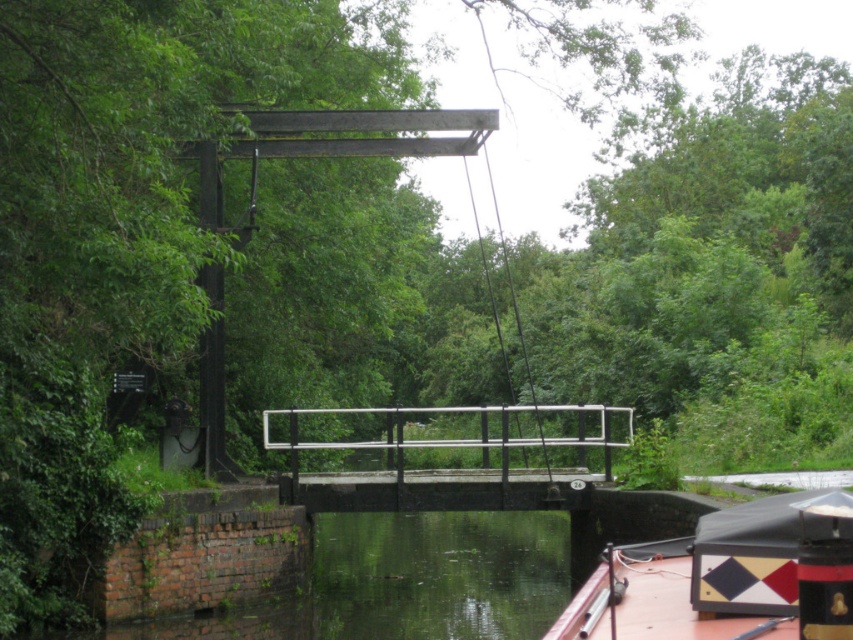
Which is in front, point (776, 524) or point (485, 429)?

Point (776, 524) is more forward.

Is red plastic boat at lower right closer to the viewer compared to white metal rail at center?

Yes, red plastic boat at lower right is in front of white metal rail at center.

Image resolution: width=853 pixels, height=640 pixels. Identify the location of red plastic boat at lower right. (700, 579).

Who is taller, green reflective water at lower center or red plastic boat at lower right?

Standing taller between the two is green reflective water at lower center.

Does green reflective water at lower center have a lesser width compared to red plastic boat at lower right?

No, green reflective water at lower center is not thinner than red plastic boat at lower right.

The width and height of the screenshot is (853, 640). What do you see at coordinates (439, 573) in the screenshot?
I see `green reflective water at lower center` at bounding box center [439, 573].

The image size is (853, 640). What are the coordinates of `green reflective water at lower center` in the screenshot? It's located at click(439, 573).

Does point (421, 570) lie in front of point (399, 408)?

No, it is not.

Is green reflective water at lower center smaller than white metal rail at center?

Yes, green reflective water at lower center is smaller than white metal rail at center.

Is point (415, 609) positioned behind point (291, 449)?

That is False.

Image resolution: width=853 pixels, height=640 pixels. I want to click on green reflective water at lower center, so coord(439,573).